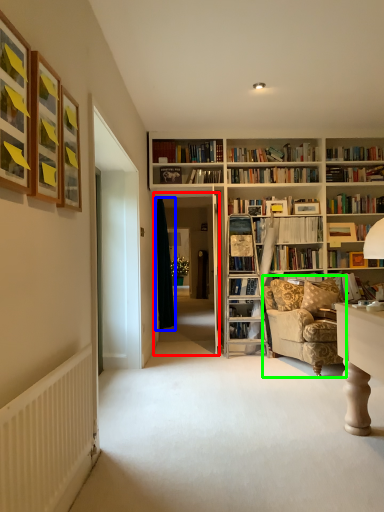
Question: Based on their relative distances, which object is farther from glass door (highlighted by a red box)? Choose from curtain (highlighted by a blue box) and chair (highlighted by a green box).

Choices:
 (A) curtain
 (B) chair

Answer: (B)